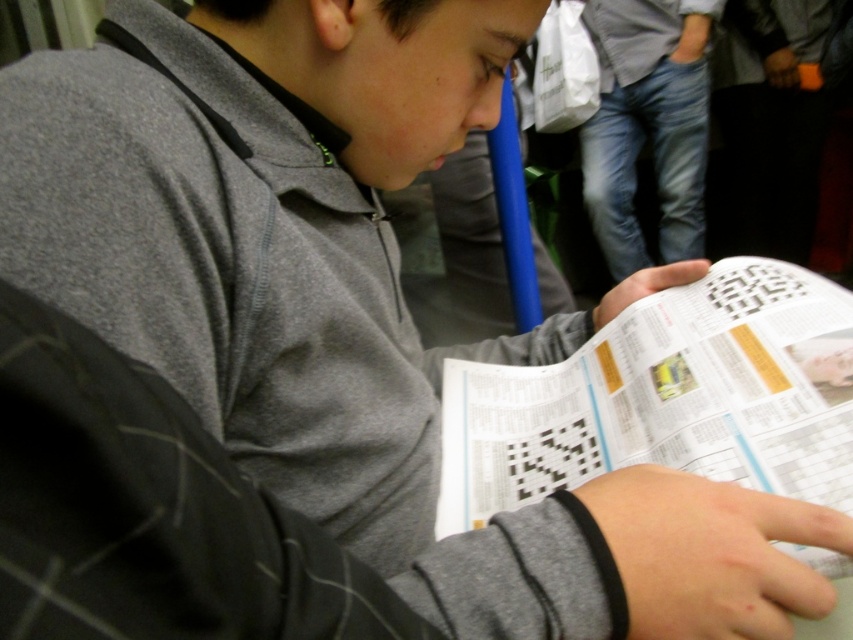
Question: From the image, what is the correct spatial relationship of white paper at center in relation to jeans at right?

Choices:
 (A) left
 (B) right

Answer: (A)

Question: Which of the following is the closest to the observer?

Choices:
 (A) jeans at right
 (B) white paper at center

Answer: (B)

Question: Is white paper at center to the right of jeans at right from the viewer's perspective?

Choices:
 (A) yes
 (B) no

Answer: (B)

Question: Which point is closer to the camera?

Choices:
 (A) white paper at center
 (B) jeans at right

Answer: (A)

Question: Observing the image, what is the correct spatial positioning of white paper at center in reference to jeans at right?

Choices:
 (A) above
 (B) below

Answer: (B)